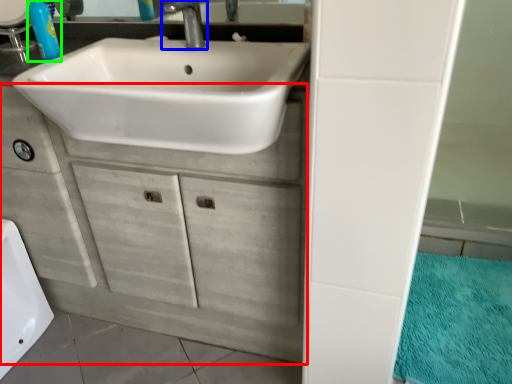
Question: Which is nearer to the bathroom cabinet (highlighted by a red box)? tap (highlighted by a blue box) or soap dispenser (highlighted by a green box).

Choices:
 (A) tap
 (B) soap dispenser

Answer: (B)